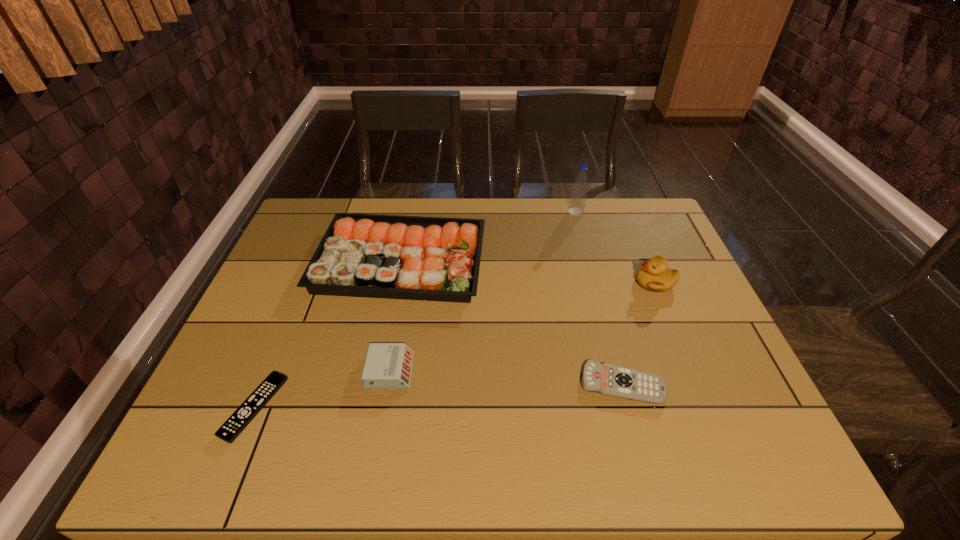
Find the location of `the tallest object`. the tallest object is located at coordinates (579, 194).

At what (x,y) coordinates should I click in order to perform the action: click on water bottle. Please return your answer as a coordinate pair (x, y). This screenshot has height=540, width=960. Looking at the image, I should click on (579, 194).

The width and height of the screenshot is (960, 540). Find the location of `duckling`. duckling is located at coordinates (654, 275).

Find the location of a particular element. Image resolution: width=960 pixels, height=540 pixels. the second tallest object is located at coordinates click(654, 275).

Identify the location of platter. The image size is (960, 540). (360, 255).

Where is `the fourth tallest object`? This screenshot has height=540, width=960. the fourth tallest object is located at coordinates (387, 365).

This screenshot has width=960, height=540. Identify the location of the taller remote control. (608, 379).

Identify the location of the right remote control. 608,379.

Locate an element on the screen. The width and height of the screenshot is (960, 540). the left remote control is located at coordinates (237, 422).

Where is `the shortest object`? the shortest object is located at coordinates (237, 422).